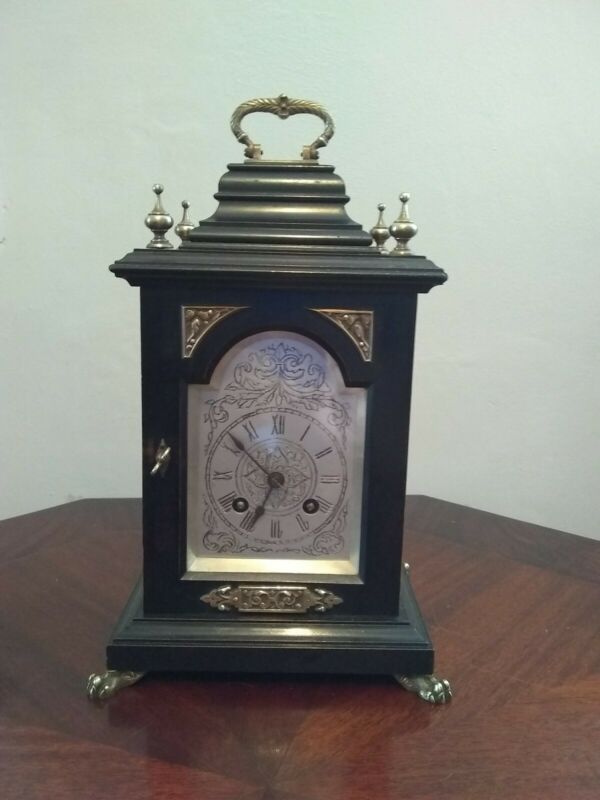
Identify the location of space on table in front of clock. (263, 754).